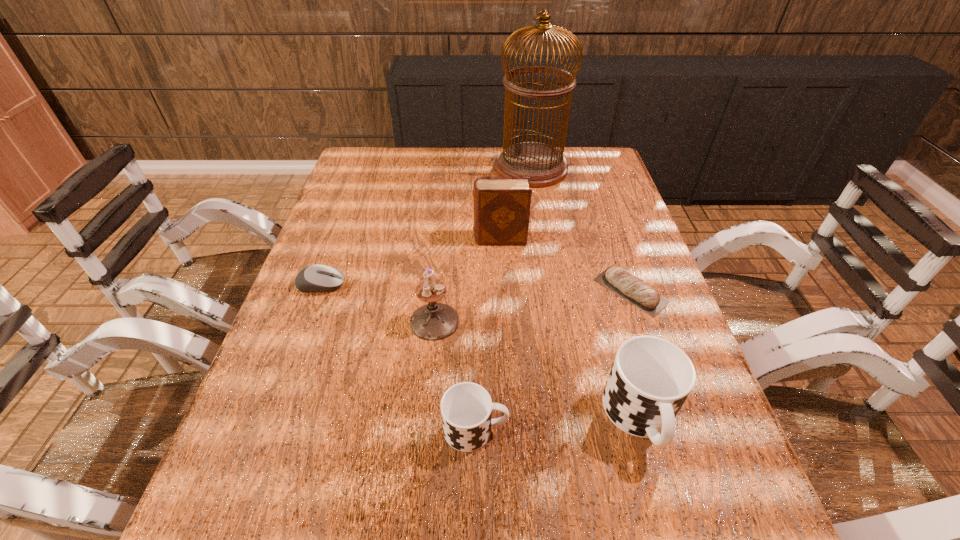
The width and height of the screenshot is (960, 540). Identify the location of vacant space at the near left corner of the desktop. (259, 472).

I want to click on vacant space at the near right corner, so click(652, 457).

Locate an element on the screen. unoccupied area between the diary and the leftmost object is located at coordinates (410, 262).

This screenshot has height=540, width=960. I want to click on empty location between the right cup and the candle holder, so click(x=538, y=369).

What are the coordinates of `vacant area that lies between the diary and the right cup` in the screenshot? It's located at (570, 328).

Locate an element on the screen. free point between the shorter cup and the candle holder is located at coordinates (455, 375).

The height and width of the screenshot is (540, 960). I want to click on blank region between the fourth shortest object and the third shortest object, so click(x=558, y=423).

Where is `vacant space that is in between the computer equipment and the right cup`? This screenshot has height=540, width=960. vacant space that is in between the computer equipment and the right cup is located at coordinates (481, 351).

Identify which object is the sixth nearest to the candle holder. Please provide its 2D coordinates. Your answer should be formatted as a tuple, i.e. [(x, y)], where the tuple contains the x and y coordinates of a point satisfying the conditions above.

[(546, 165)]

This screenshot has width=960, height=540. I want to click on object that can be found as the sixth closest to the leftmost object, so click(617, 279).